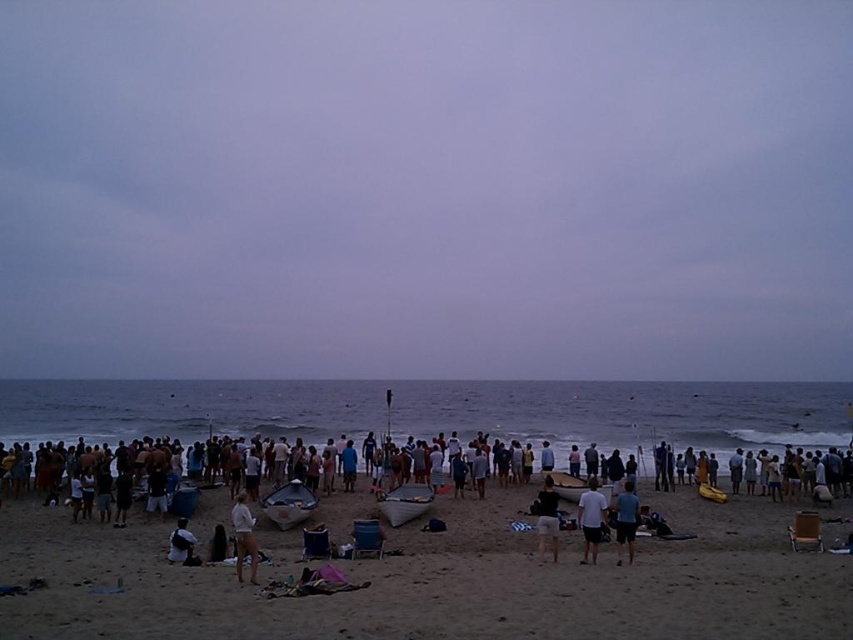
Consider the image. You are standing at the beach and want to walk from point A to point B. If point A is at coordinate point(427, 502) and point B is at coordinate point(236, 497), which direction should you walk to reach point B from point A?

To reach point B from point A, you should walk backward because point A is in front of point B according to their coordinates.

What are the coordinates of the sandy beach at center?

The coordinates of the sandy beach at center are at point (439,582).

Where is the white plastic boat at center located in the image?

The white plastic boat at center is located at point 0.786 on the x axis and 0.475 on the y axis.